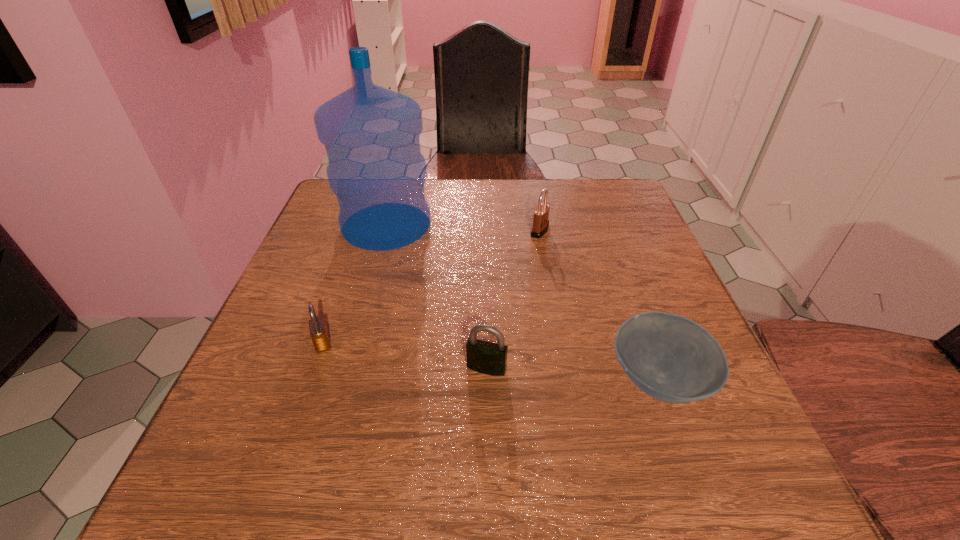
Locate an element on the screen. Image resolution: width=960 pixels, height=540 pixels. vacant space at the left edge of the desktop is located at coordinates (291, 287).

Where is `vacant space at the right edge`? The width and height of the screenshot is (960, 540). vacant space at the right edge is located at coordinates (661, 279).

Locate an element on the screen. This screenshot has height=540, width=960. free location at the near left corner of the desktop is located at coordinates (272, 474).

In the image, there is a desktop. Where is `vacant space at the far right corner`? vacant space at the far right corner is located at coordinates (606, 208).

I want to click on vacant space at the near right corner of the desktop, so click(750, 455).

Where is `vacant point located between the tallest object and the leftmost padlock`? Image resolution: width=960 pixels, height=540 pixels. vacant point located between the tallest object and the leftmost padlock is located at coordinates (354, 284).

Image resolution: width=960 pixels, height=540 pixels. Identify the location of free space between the farthest padlock and the water jug. (463, 228).

The width and height of the screenshot is (960, 540). Find the location of `blank region between the second object from right to left and the leftmost padlock`. blank region between the second object from right to left and the leftmost padlock is located at coordinates (431, 287).

You are a GUI agent. You are given a task and a screenshot of the screen. Output one action in this format:
    pyautogui.click(x=<x>, y=<y>)
    Task: Click on the unoccupied position between the shortest object and the tallest object
    
    Given the screenshot: What is the action you would take?
    pyautogui.click(x=522, y=302)

I want to click on vacant area that lies between the second nearest padlock and the fourth object from left to right, so click(x=431, y=287).